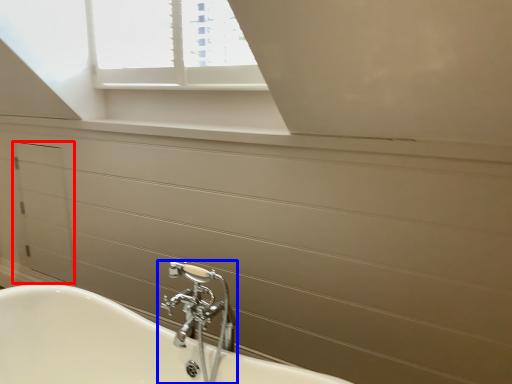
Question: Which point is closer to the camera, drawer (highlighted by a red box) or tap (highlighted by a blue box)?

Choices:
 (A) drawer
 (B) tap

Answer: (B)